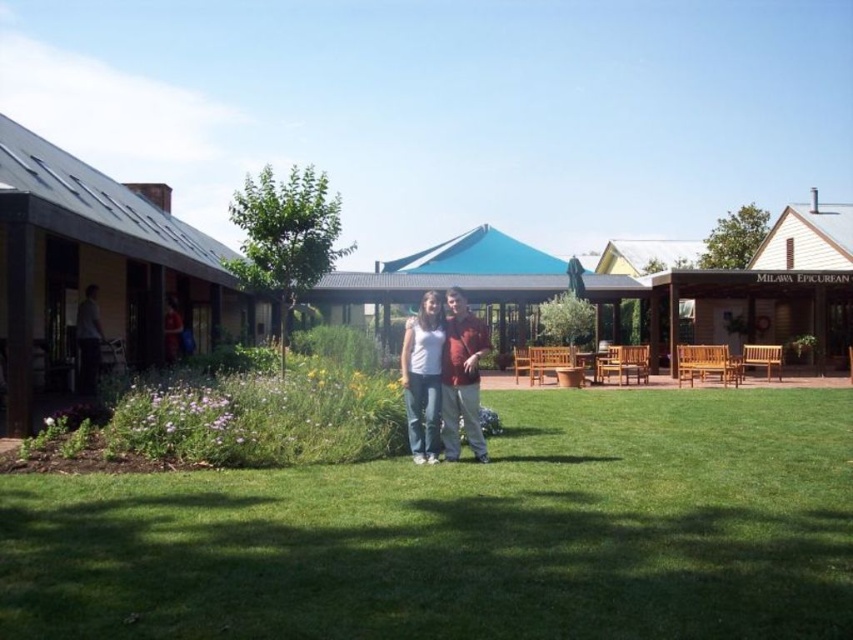
Question: Which point is farther to the camera?

Choices:
 (A) [469, 324]
 (B) [86, 356]

Answer: (B)

Question: Is green grass at center bigger than matte white shirt at center?

Choices:
 (A) yes
 (B) no

Answer: (A)

Question: Is green grass at center to the left of matte white shirt at center from the viewer's perspective?

Choices:
 (A) no
 (B) yes

Answer: (A)

Question: Which object appears farthest from the camera in this image?

Choices:
 (A) matte gray shirt at left
 (B) matte white shirt at center

Answer: (A)

Question: Is green grass at center thinner than matte gray shirt at left?

Choices:
 (A) no
 (B) yes

Answer: (A)

Question: Which object is farther from the camera taking this photo?

Choices:
 (A) green grass at center
 (B) matte white shirt at center
 (C) matte gray shirt at left

Answer: (C)